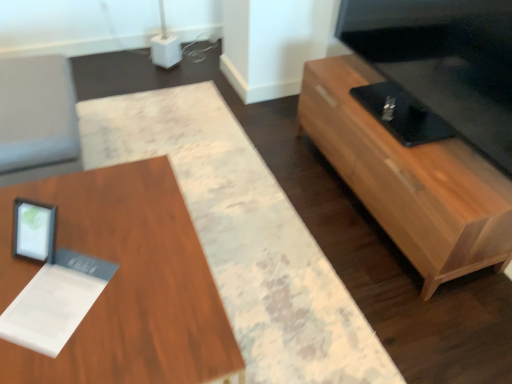
Question: From the image's perspective, is wooden tv stand at right, which is the 2th table from left to right, under wooden table at center, which is the 1th table in left-to-right order?

Choices:
 (A) no
 (B) yes

Answer: (A)

Question: Is wooden tv stand at right, which ranks as the first table in right-to-left order, positioned far away from wooden table at center, which is the 1th table in left-to-right order?

Choices:
 (A) no
 (B) yes

Answer: (A)

Question: Is wooden tv stand at right, which ranks as the first table in right-to-left order, looking in the opposite direction of wooden table at center, which is the 1th table in left-to-right order?

Choices:
 (A) no
 (B) yes

Answer: (A)

Question: Considering the relative sizes of wooden tv stand at right, which is the 2th table from left to right, and wooden table at center, which appears as the second table when viewed from the right, in the image provided, is wooden tv stand at right, which is the 2th table from left to right, taller than wooden table at center, which appears as the second table when viewed from the right,?

Choices:
 (A) no
 (B) yes

Answer: (B)

Question: Does wooden tv stand at right, which is the 2th table from left to right, turn towards wooden table at center, which appears as the second table when viewed from the right?

Choices:
 (A) yes
 (B) no

Answer: (A)

Question: Does wooden tv stand at right, which is the 2th table from left to right, have a lesser height compared to wooden table at center, which is the 1th table in left-to-right order?

Choices:
 (A) no
 (B) yes

Answer: (A)

Question: Is wooden table at center, which appears as the second table when viewed from the right, facing away from wooden tv stand at right, which ranks as the first table in right-to-left order?

Choices:
 (A) yes
 (B) no

Answer: (B)

Question: From the image's perspective, would you say wooden table at center, which appears as the second table when viewed from the right, is shown under wooden tv stand at right, which is the 2th table from left to right?

Choices:
 (A) yes
 (B) no

Answer: (A)

Question: Are wooden table at center, which appears as the second table when viewed from the right, and wooden tv stand at right, which ranks as the first table in right-to-left order, making contact?

Choices:
 (A) no
 (B) yes

Answer: (A)

Question: Can we say wooden table at center, which appears as the second table when viewed from the right, lies outside wooden tv stand at right, which is the 2th table from left to right?

Choices:
 (A) yes
 (B) no

Answer: (A)

Question: Considering the relative positions of wooden table at center, which appears as the second table when viewed from the right, and wooden tv stand at right, which ranks as the first table in right-to-left order, in the image provided, is wooden table at center, which appears as the second table when viewed from the right, to the left of wooden tv stand at right, which ranks as the first table in right-to-left order, from the viewer's perspective?

Choices:
 (A) no
 (B) yes

Answer: (B)

Question: Is wooden table at center, which appears as the second table when viewed from the right, thinner than wooden tv stand at right, which is the 2th table from left to right?

Choices:
 (A) no
 (B) yes

Answer: (A)

Question: From the image's perspective, is wooden tv stand at right, which is the 2th table from left to right, located above or below wooden table at center, which appears as the second table when viewed from the right?

Choices:
 (A) below
 (B) above

Answer: (B)